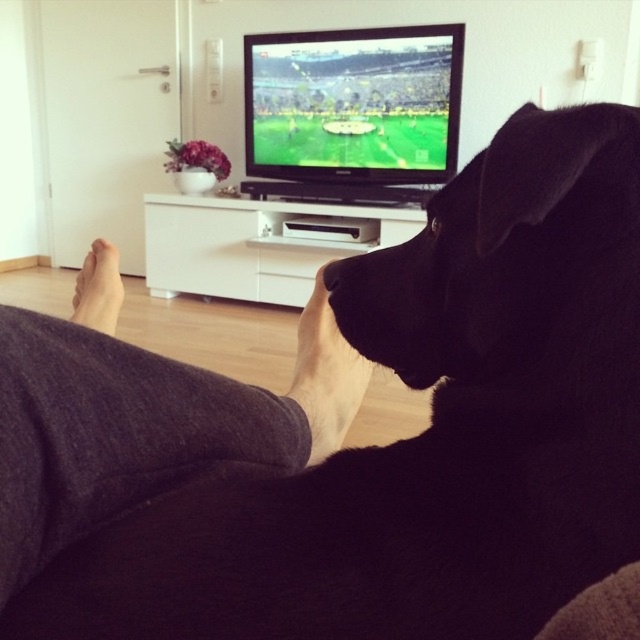
Based on the photo, is black matte skin at lower center further to camera compared to black smooth nose at lower center?

Yes.

Who is positioned more to the left, black matte skin at lower center or black smooth nose at lower center?

Positioned to the left is black matte skin at lower center.

Does point (304, 364) lie behind point (328, 269)?

That is True.

You are a GUI agent. You are given a task and a screenshot of the screen. Output one action in this format:
    pyautogui.click(x=<x>, y=<y>)
    Task: Click on the black matte skin at lower center
    
    Given the screenshot: What is the action you would take?
    pyautogui.click(x=324, y=376)

Is skinny flesh-toned foot at lower left above black smooth nose at lower center?

No.

Between point (104, 300) and point (324, 280), which one is positioned behind?

The point (104, 300) is more distant.

In order to click on skinny flesh-toned foot at lower left in this screenshot , I will do `click(99, 289)`.

Who is positioned more to the right, dark gray fabric leg at lower left or green grass field at center?

Positioned to the right is green grass field at center.

Does point (150, 360) come closer to viewer compared to point (262, 40)?

Yes, point (150, 360) is in front of point (262, 40).

Image resolution: width=640 pixels, height=640 pixels. What do you see at coordinates (145, 424) in the screenshot?
I see `dark gray fabric leg at lower left` at bounding box center [145, 424].

Locate an element on the screen. This screenshot has width=640, height=640. dark gray fabric leg at lower left is located at coordinates pyautogui.click(x=145, y=424).